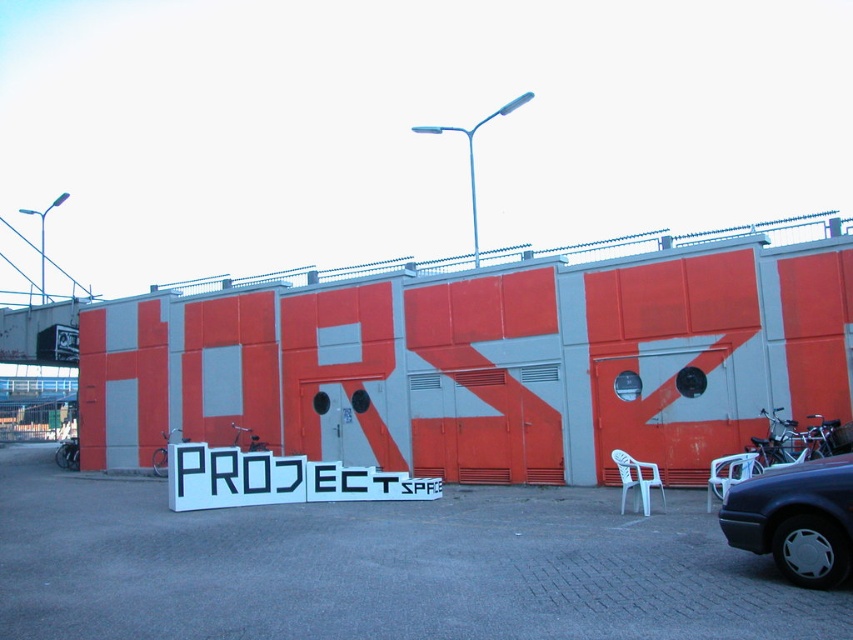
Is point (372, 595) closer to camera compared to point (770, 486)?

Yes, it is in front of point (770, 486).

Is point (177, 586) farther from viewer compared to point (802, 500)?

That is True.

In the scene shown: Measure the distance between gray concrete parking lot at center and camera.

They are 4.85 meters apart.

Locate an element on the screen. The image size is (853, 640). gray concrete parking lot at center is located at coordinates (379, 566).